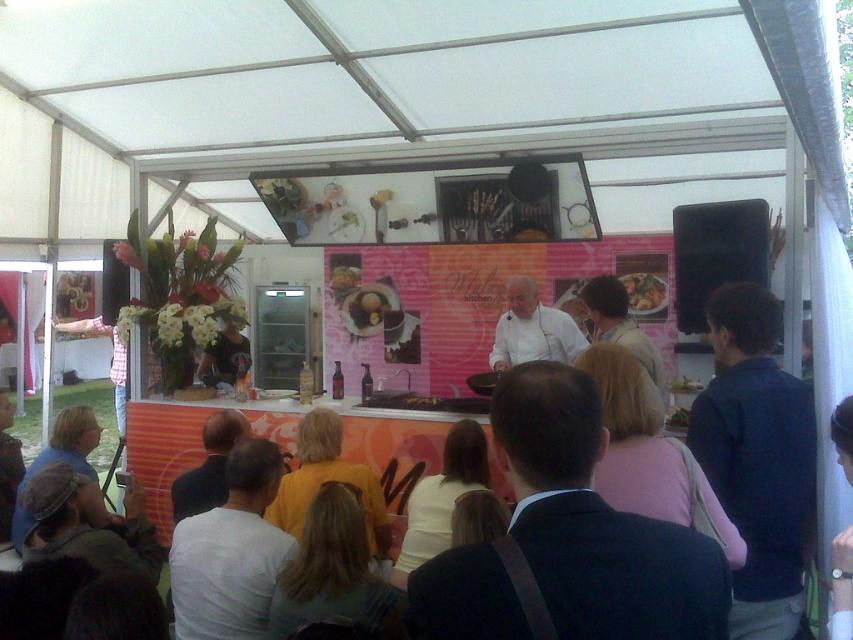
Question: Can you confirm if white chef coat at center is thinner than shiny golden plate at center?

Choices:
 (A) yes
 (B) no

Answer: (B)

Question: Among these points, which one is farthest from the camera?

Choices:
 (A) [634, 308]
 (B) [535, 288]

Answer: (A)

Question: Can you confirm if white chef coat at center is positioned to the right of shiny golden plate at center?

Choices:
 (A) no
 (B) yes

Answer: (A)

Question: Is white chef coat at center above shiny golden plate at center?

Choices:
 (A) yes
 (B) no

Answer: (B)